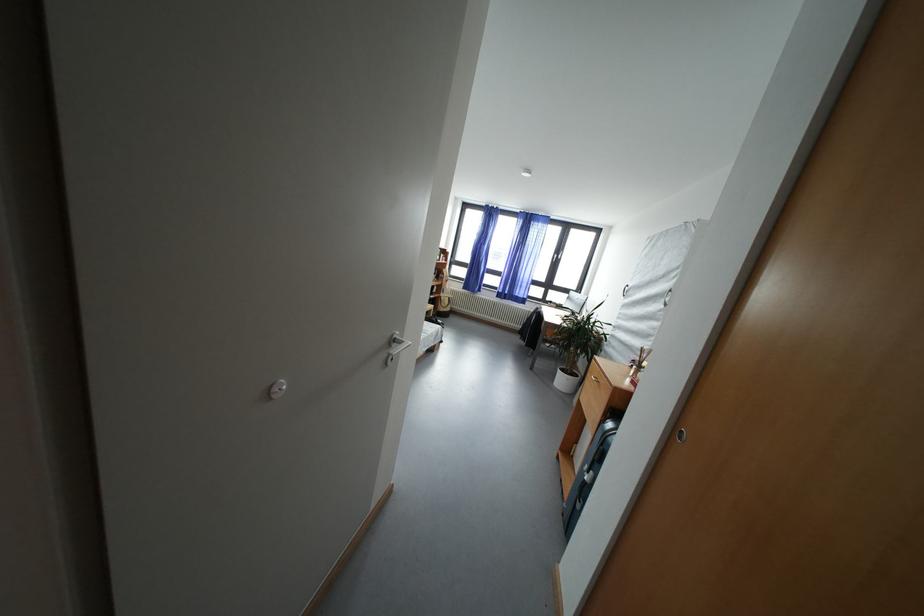
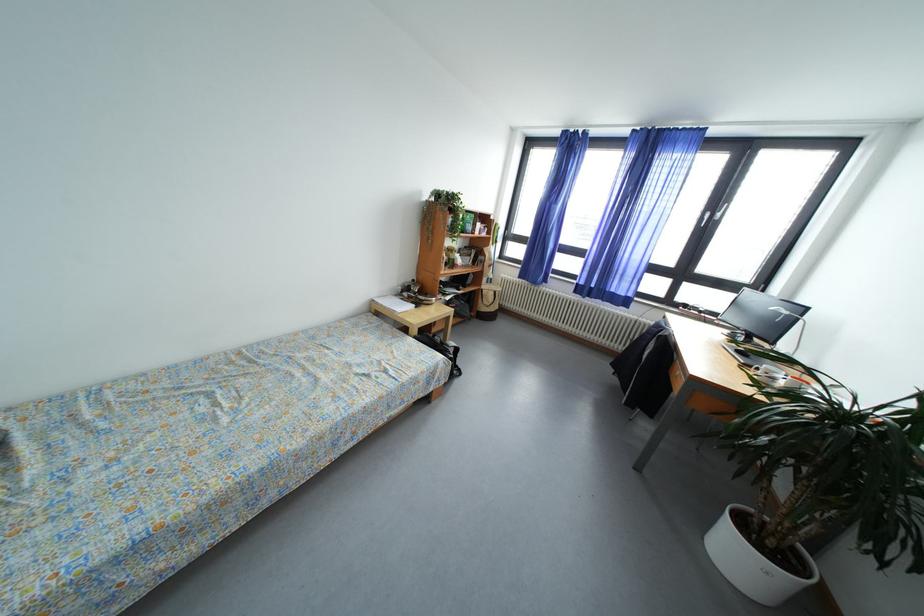
Find the pixel in the second image that matches [568,386] in the first image.

(745, 561)